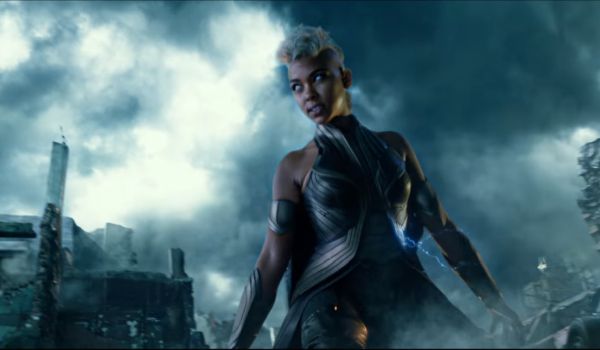
You are a GUI agent. You are given a task and a screenshot of the screen. Output one action in this format:
    pyautogui.click(x=<x>, y=<y>)
    Task: Click on the chest
    This screenshot has height=350, width=600.
    Given the screenshot: What is the action you would take?
    pyautogui.click(x=354, y=182)